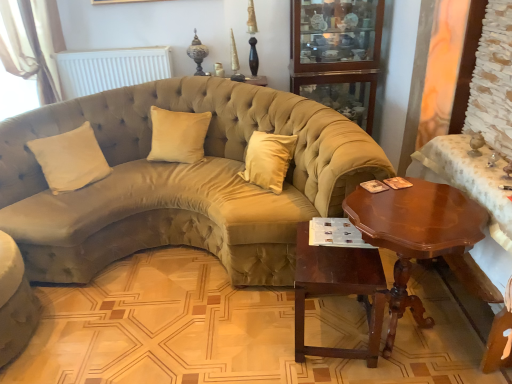
Question: Is beige velvet pillow at left, which is the second pillow from right to left, further to the viewer compared to white matte radiator at upper center?

Choices:
 (A) yes
 (B) no

Answer: (B)

Question: Is white matte radiator at upper center completely or partially inside beige velvet pillow at left, which is the second pillow from right to left?

Choices:
 (A) no
 (B) yes

Answer: (A)

Question: Is beige velvet pillow at left, the 1th pillow in the left-to-right sequence, thinner than white matte radiator at upper center?

Choices:
 (A) yes
 (B) no

Answer: (B)

Question: Can we say beige velvet pillow at left, which is the second pillow from right to left, lies outside white matte radiator at upper center?

Choices:
 (A) no
 (B) yes

Answer: (B)

Question: Is beige velvet pillow at left, which is the second pillow from right to left, in contact with white matte radiator at upper center?

Choices:
 (A) no
 (B) yes

Answer: (A)

Question: Is beige velvet pillow at left, the 1th pillow in the left-to-right sequence, shorter than white matte radiator at upper center?

Choices:
 (A) no
 (B) yes

Answer: (A)

Question: From the image's perspective, is white matte radiator at upper center below shiny brown wood coffee table at right?

Choices:
 (A) no
 (B) yes

Answer: (A)

Question: Is white matte radiator at upper center shorter than shiny brown wood coffee table at right?

Choices:
 (A) no
 (B) yes

Answer: (B)

Question: Is white matte radiator at upper center wider than shiny brown wood coffee table at right?

Choices:
 (A) no
 (B) yes

Answer: (A)

Question: Is white matte radiator at upper center thinner than shiny brown wood coffee table at right?

Choices:
 (A) yes
 (B) no

Answer: (A)

Question: Does white matte radiator at upper center have a larger size compared to shiny brown wood coffee table at right?

Choices:
 (A) no
 (B) yes

Answer: (A)

Question: Does white matte radiator at upper center have a smaller size compared to shiny brown wood coffee table at right?

Choices:
 (A) yes
 (B) no

Answer: (A)

Question: From a real-world perspective, is beige fabric curtain at upper left over glass cabinet at upper center?

Choices:
 (A) yes
 (B) no

Answer: (A)